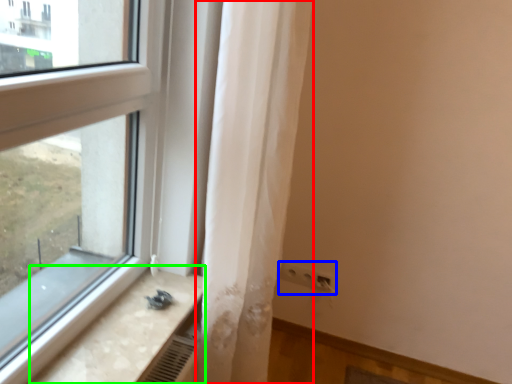
Question: Which object is the farthest from curtain (highlighted by a red box)? Choose among these: electric outlet (highlighted by a blue box) or counter top (highlighted by a green box).

Choices:
 (A) electric outlet
 (B) counter top

Answer: (A)